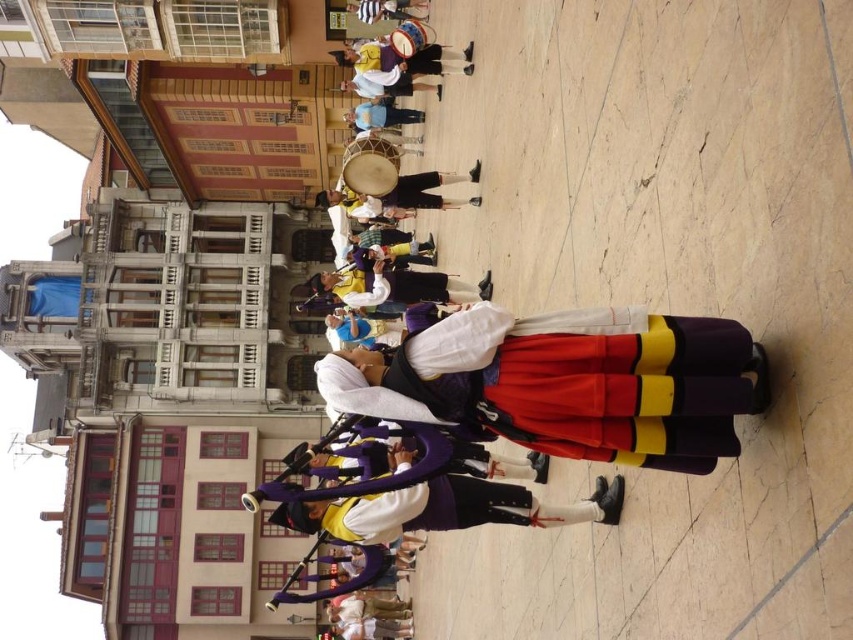
You are a photographer at the event and want to capture a photo of the purple velvet bagpipe at center and the white cotton shirt at center. Which object should you focus on first if you want to ensure both are in focus without adjusting your camera settings?

The purple velvet bagpipe at center is above the white cotton shirt at center, so focusing on the white cotton shirt at center first would ensure both are in focus since it is closer to the camera.

You are a photographer standing at the edge of the crowd. You want to capture a photo that includes both the purple velvet bagpipe at center and the white cotton shirt at center. Given that your camera has a maximum focus range of 65 feet, will you be able to include both in the same frame without moving closer?

The purple velvet bagpipe at center and the white cotton shirt at center are 64.91 feet apart. Since the distance between them is less than the camera maximum focus range of 65 feet, you can include both in the same frame without moving closer.